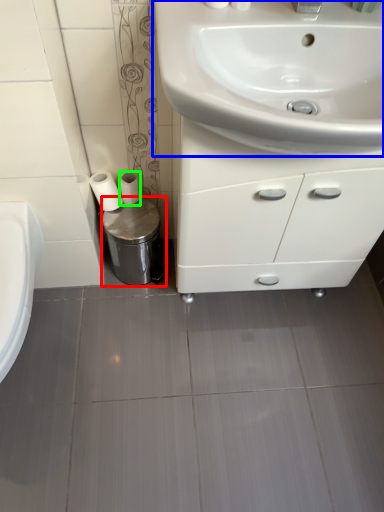
Question: Considering the real-world distances, which object is farthest from bidet (highlighted by a red box)? sink (highlighted by a blue box) or toilet paper (highlighted by a green box)?

Choices:
 (A) sink
 (B) toilet paper

Answer: (A)